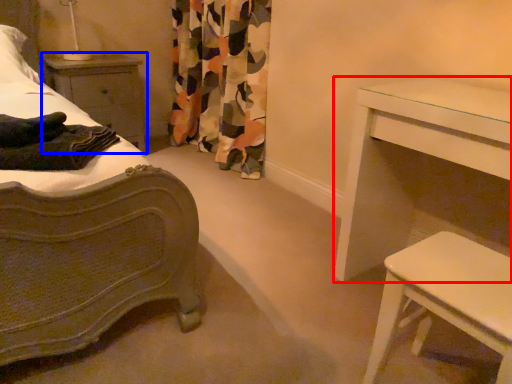
Question: Which of the following is the farthest to the observer, table (highlighted by a red box) or nightstand (highlighted by a blue box)?

Choices:
 (A) table
 (B) nightstand

Answer: (B)